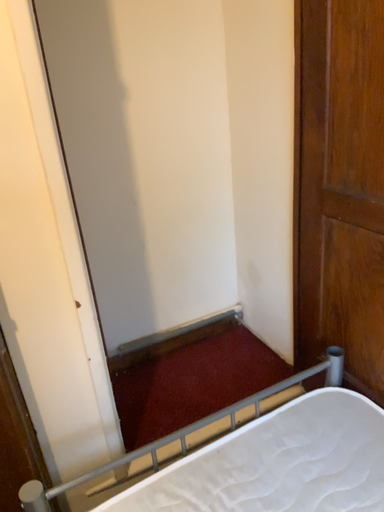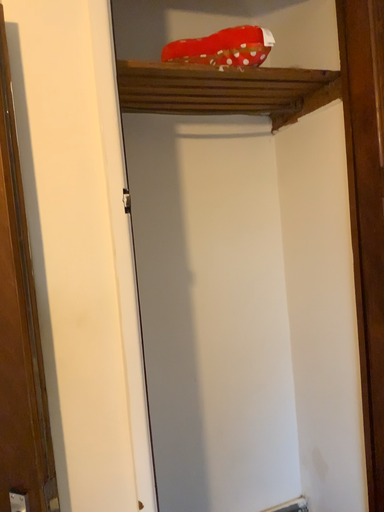
Question: How did the camera likely rotate when shooting the video?

Choices:
 (A) rotated upward
 (B) rotated downward

Answer: (A)